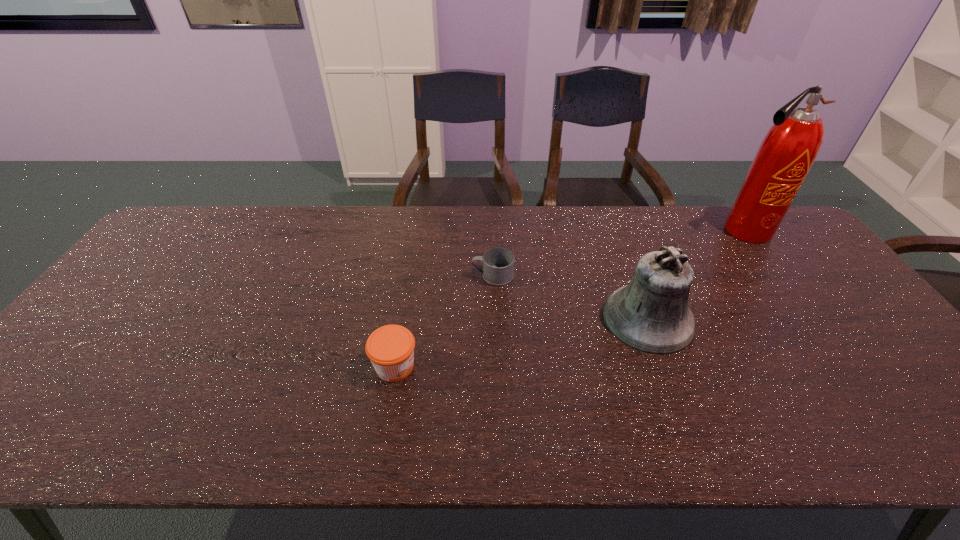
Where is `free point between the tallest object and the mug`? free point between the tallest object and the mug is located at coordinates (618, 253).

Select which object appears as the second closest to the mug. Please provide its 2D coordinates. Your answer should be formatted as a tuple, i.e. [(x, y)], where the tuple contains the x and y coordinates of a point satisfying the conditions above.

[(390, 348)]

Where is `object that is the third closest one to the leftmost object`? The width and height of the screenshot is (960, 540). object that is the third closest one to the leftmost object is located at coordinates click(789, 149).

At what (x,y) coordinates should I click in order to perform the action: click on free location that satisfies the following two spatial constraints: 1. on the front side of the third object from left to right; 2. on the front label of the second shortest object. Please return your answer as a coordinate pair (x, y). Image resolution: width=960 pixels, height=540 pixels. Looking at the image, I should click on (665, 366).

The image size is (960, 540). I want to click on blank area in the image that satisfies the following two spatial constraints: 1. on the back side of the third object from left to right; 2. on the left side of the fire extinguisher, so click(615, 231).

This screenshot has height=540, width=960. I want to click on vacant space that satisfies the following two spatial constraints: 1. on the side of the third object from right to left with the handle; 2. on the back side of the second object from right to left, so click(493, 319).

The height and width of the screenshot is (540, 960). I want to click on free point that satisfies the following two spatial constraints: 1. on the side of the mug with the handle; 2. on the back side of the second object from right to left, so click(x=493, y=319).

Locate an element on the screen. Image resolution: width=960 pixels, height=540 pixels. vacant region that satisfies the following two spatial constraints: 1. on the front side of the bell; 2. on the front label of the jam is located at coordinates (665, 366).